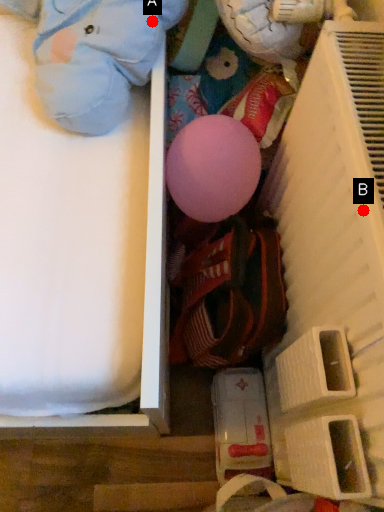
Question: Two points are circled on the image, labeled by A and B beside each circle. Which point is further to the camera?

Choices:
 (A) A is further
 (B) B is further

Answer: (A)